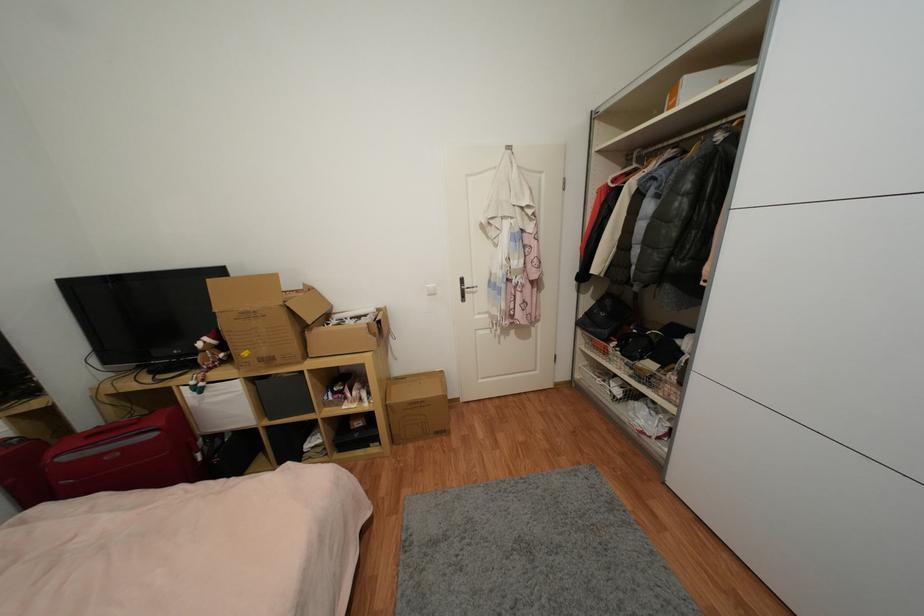
I want to click on open cardboard box, so click(x=263, y=318).